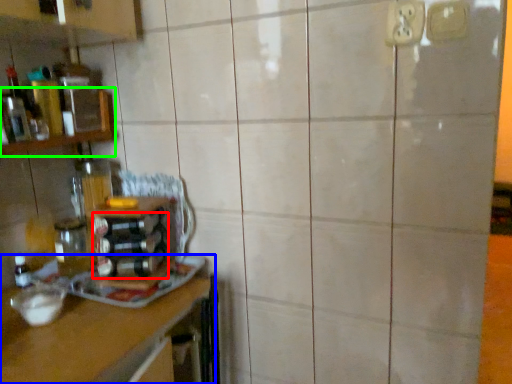
Question: Which object is positioned farthest from bottle (highlighted by a red box)? Select from countertop (highlighted by a blue box) and shelf (highlighted by a green box).

Choices:
 (A) countertop
 (B) shelf

Answer: (B)